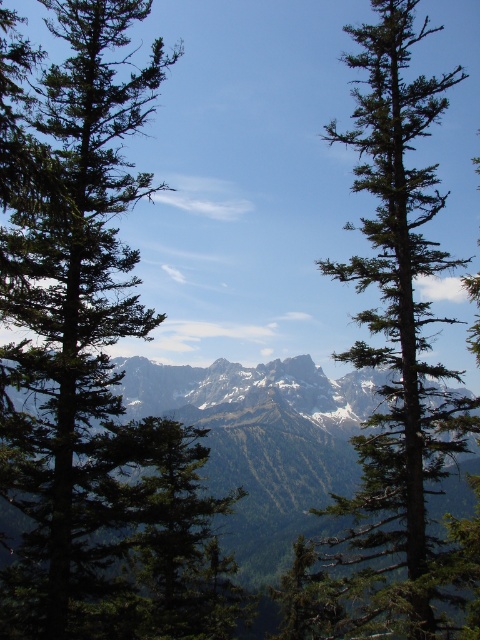
Question: Which of the following is the closest to the observer?

Choices:
 (A) green needle-like at center
 (B) green matte tree at center

Answer: (B)

Question: Can you confirm if green matte tree at center is smaller than green needle-like at center?

Choices:
 (A) yes
 (B) no

Answer: (A)

Question: Which of the following is the closest to the observer?

Choices:
 (A) (119, 252)
 (B) (397, 440)

Answer: (B)

Question: Does green matte tree at center have a smaller size compared to green needle-like at center?

Choices:
 (A) no
 (B) yes

Answer: (B)

Question: Which point is closer to the camera?

Choices:
 (A) (381, 42)
 (B) (40, 300)

Answer: (B)

Question: From the image, what is the correct spatial relationship of green matte tree at center in relation to green needle-like at center?

Choices:
 (A) right
 (B) left

Answer: (B)